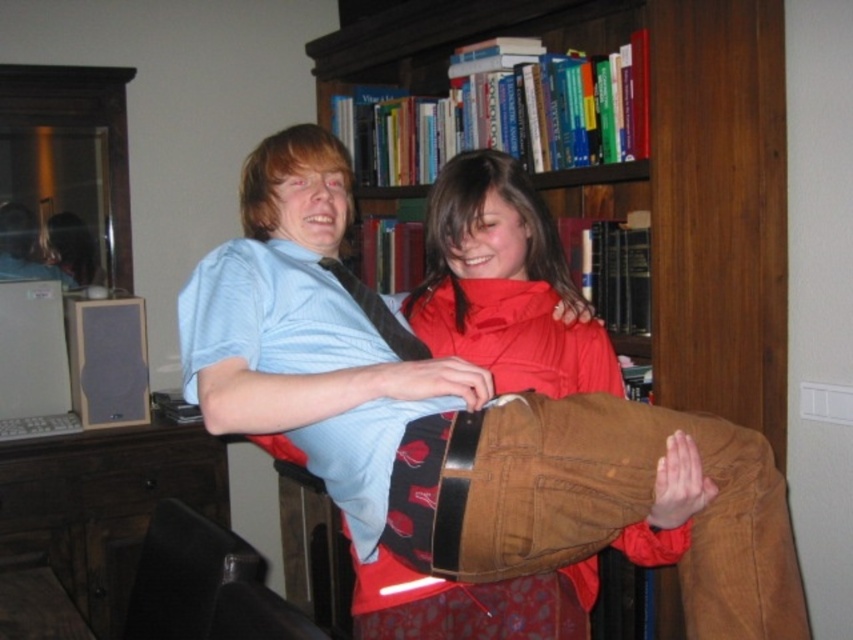
Which of these two, wooden bookshelf at upper center or corduroy pants at center, stands shorter?

corduroy pants at center

Who is more forward, (373, 58) or (585, 362)?

Point (585, 362)

Locate an element on the screen. This screenshot has width=853, height=640. wooden bookshelf at upper center is located at coordinates (646, 168).